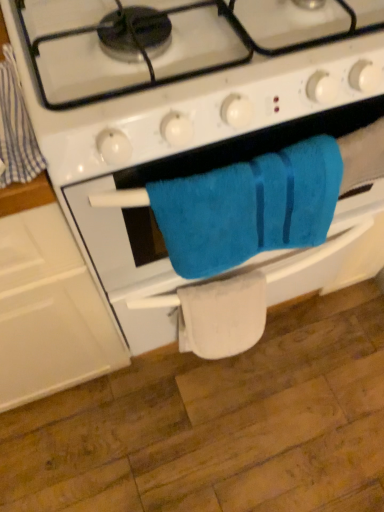
Question: From a real-world perspective, is blue cotton towel at left above or below blue soft towel at center?

Choices:
 (A) below
 (B) above

Answer: (B)

Question: Considering the relative positions of blue cotton towel at left and blue soft towel at center in the image provided, is blue cotton towel at left to the left or to the right of blue soft towel at center?

Choices:
 (A) left
 (B) right

Answer: (A)

Question: Which object is positioned closest to the turquoise soft towel at center?

Choices:
 (A) blue soft towel at center
 (B) blue cotton towel at left
 (C) white fabric towel at lower center

Answer: (A)

Question: Considering the real-world distances, which object is farthest from the turquoise soft towel at center?

Choices:
 (A) blue soft towel at center
 (B) blue cotton towel at left
 (C) white fabric towel at lower center

Answer: (B)